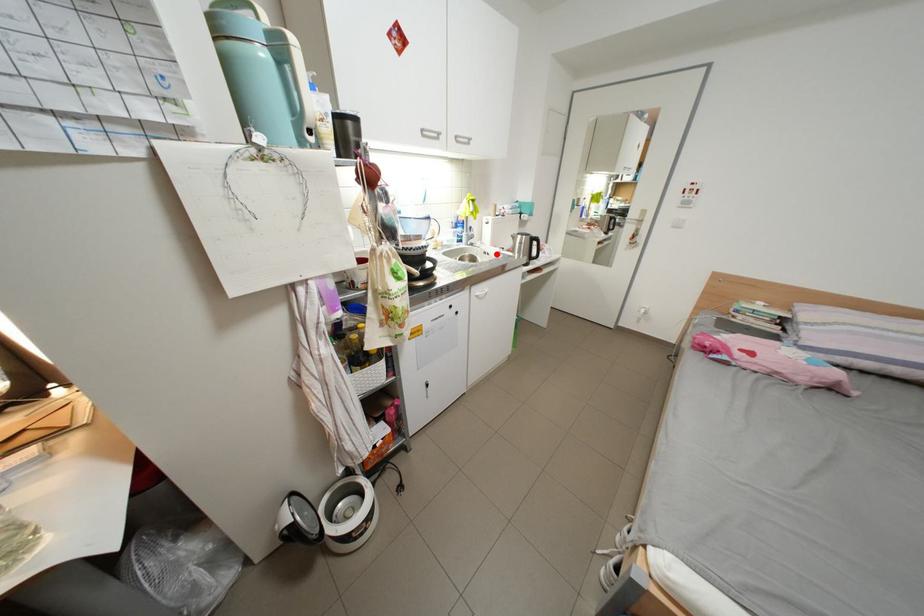
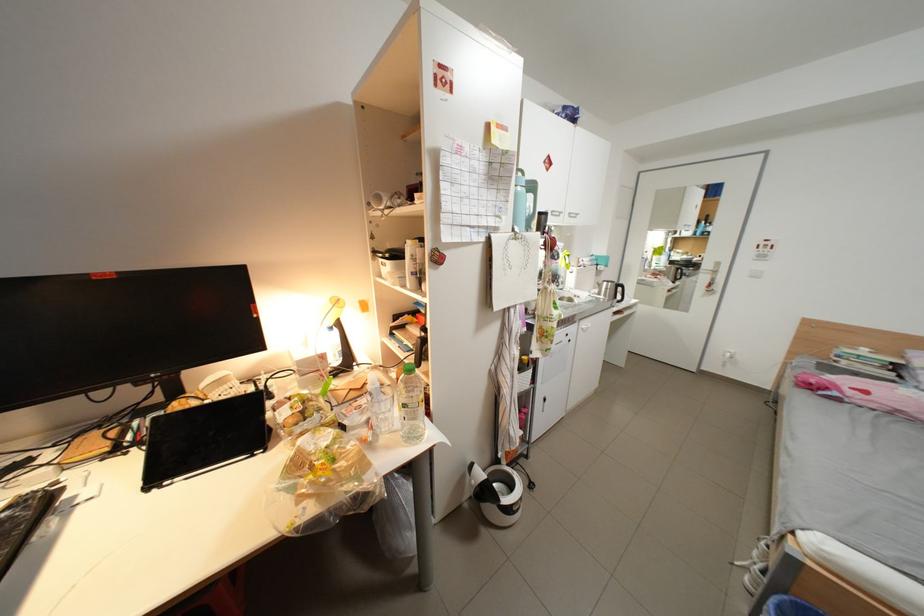
Find the pixel in the second image that matches the highlighted location in the first image.

(587, 297)